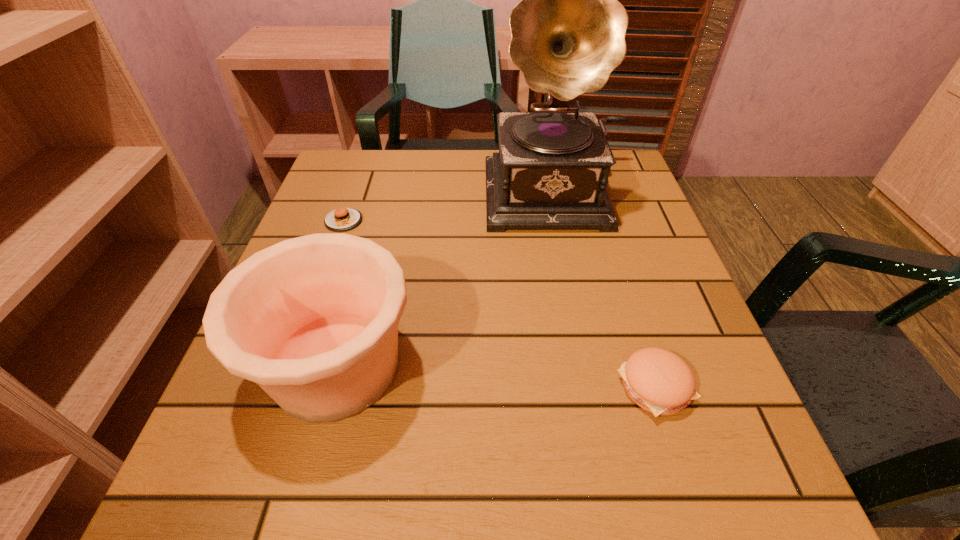
You are a GUI agent. You are given a task and a screenshot of the screen. Output one action in this format:
    pyautogui.click(x=<x>, y=<y>)
    Task: Click on the record player
    
    Given the screenshot: What is the action you would take?
    pyautogui.click(x=568, y=33)

Locate an element on the screen. The height and width of the screenshot is (540, 960). the second tallest object is located at coordinates (313, 320).

The height and width of the screenshot is (540, 960). What are the coordinates of `the right food` in the screenshot? It's located at [659, 381].

Where is `the second shortest object`? This screenshot has width=960, height=540. the second shortest object is located at coordinates (659, 381).

The height and width of the screenshot is (540, 960). In order to click on the shortest object in this screenshot , I will do `click(342, 219)`.

The width and height of the screenshot is (960, 540). I want to click on the shorter food, so click(342, 219).

At what (x,y) coordinates should I click in order to perform the action: click on free space located on the horn of the record player. Please return your answer as a coordinate pair (x, y). Looking at the image, I should click on (588, 323).

I want to click on vacant space located 0.160m on the back of the pottery, so click(369, 247).

Find the location of `vacant space located on the left of the right food`. vacant space located on the left of the right food is located at coordinates (377, 387).

At what (x,y) coordinates should I click in order to perform the action: click on free point located 0.050m on the back of the shorter food. Please return your answer as a coordinate pair (x, y). The height and width of the screenshot is (540, 960). Looking at the image, I should click on (352, 197).